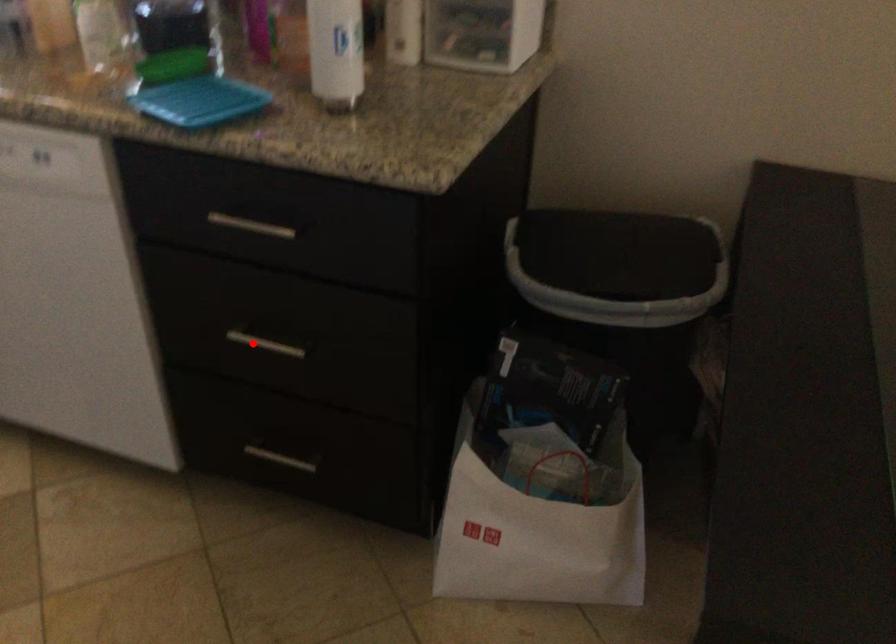
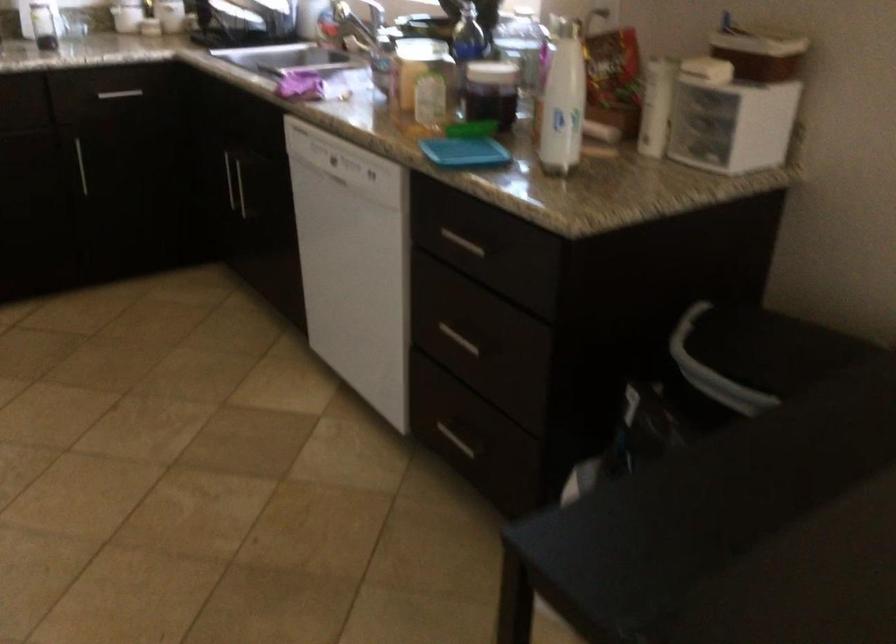
Question: I am providing you with two images of the same scene from different viewpoints. A red point is marked on the first image. At the location where the point appears in image 1, is it still visible in image 2?

Choices:
 (A) Yes
 (B) No

Answer: (A)